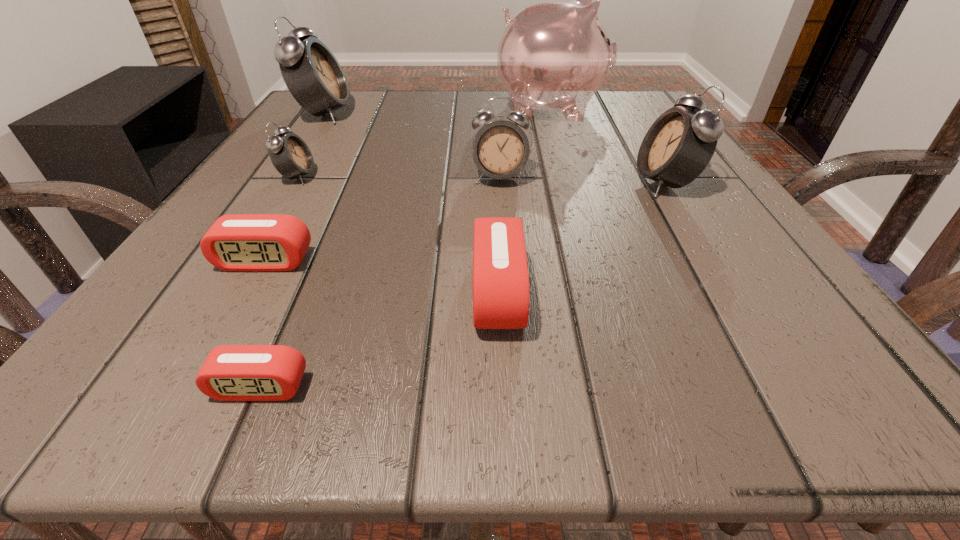
Find the location of a particular element. The height and width of the screenshot is (540, 960). piggy bank is located at coordinates tap(554, 56).

Identify the location of the biggest white alarm clock. This screenshot has width=960, height=540. (314, 77).

This screenshot has width=960, height=540. Identify the location of the seventh shortest object. (314, 77).

Identify the location of the rightmost alarm clock. This screenshot has width=960, height=540. (679, 145).

Where is `the sixth shortest object`? The height and width of the screenshot is (540, 960). the sixth shortest object is located at coordinates (679, 145).

You are a GUI agent. You are given a task and a screenshot of the screen. Output one action in this format:
    pyautogui.click(x=<x>, y=<y>)
    Task: Click on the fourth tallest object
    This screenshot has height=540, width=960.
    Given the screenshot: What is the action you would take?
    pyautogui.click(x=500, y=150)

At what (x,y) coordinates should I click in order to perform the action: click on the third white alarm clock from left to right. Please return your answer as a coordinate pair (x, y). Image resolution: width=960 pixels, height=540 pixels. Looking at the image, I should click on (500, 150).

You are a GUI agent. You are given a task and a screenshot of the screen. Output one action in this format:
    pyautogui.click(x=<x>, y=<y>)
    Task: Click on the fourth shortest alarm clock
    The height and width of the screenshot is (540, 960).
    Given the screenshot: What is the action you would take?
    pyautogui.click(x=290, y=155)

You are a GUI agent. You are given a task and a screenshot of the screen. Output one action in this format:
    pyautogui.click(x=<x>, y=<y>)
    Task: Click on the fourth shortest object
    This screenshot has width=960, height=540.
    Given the screenshot: What is the action you would take?
    pyautogui.click(x=290, y=155)

Where is `the rightmost pink alarm clock`? This screenshot has height=540, width=960. the rightmost pink alarm clock is located at coordinates (501, 294).